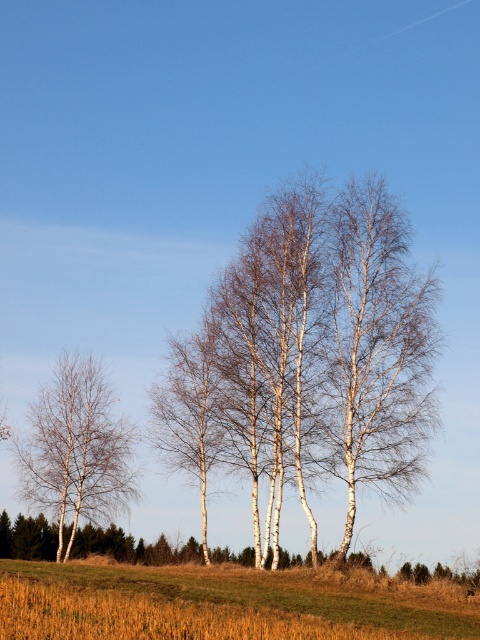
Is point (456, 589) less distant than point (422, 275)?

Yes, point (456, 589) is in front of point (422, 275).

Identify the location of brown grass at lower center. (220, 604).

Measure the distance from brown grass at lower center to white smooth tree at left.

They are 24.61 meters apart.

Does brown grass at lower center have a lesser height compared to white smooth tree at left?

In fact, brown grass at lower center may be taller than white smooth tree at left.

Does point (95, 602) come behind point (82, 424)?

No.

Identify the location of brown grass at lower center. (220, 604).

Is point (384, 275) closer to viewer compared to point (100, 516)?

Yes, point (384, 275) is in front of point (100, 516).

Who is positioned more to the left, white bark birch tree at center or white smooth tree at left?

white smooth tree at left

Is point (349, 218) farther from viewer compared to point (71, 433)?

That is False.

In order to click on white bark birch tree at center in this screenshot , I will do `click(375, 352)`.